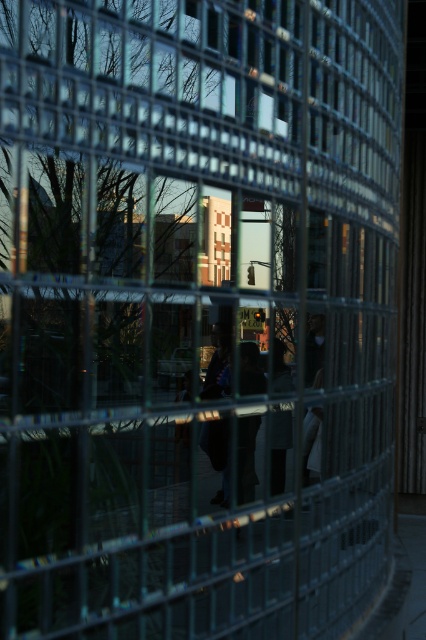
Question: Which point appears farthest from the camera in this image?

Choices:
 (A) (293, 387)
 (B) (241, 380)

Answer: (A)

Question: Which point is farther from the camera taking this photo?

Choices:
 (A) (287, 420)
 (B) (224, 384)

Answer: (A)

Question: Is dark fabric figure at center to the right of dark gray fabric at center from the viewer's perspective?

Choices:
 (A) no
 (B) yes

Answer: (A)

Question: Does dark fabric figure at center appear under dark gray fabric at center?

Choices:
 (A) no
 (B) yes

Answer: (A)

Question: Is dark fabric figure at center further to the viewer compared to dark gray fabric at center?

Choices:
 (A) yes
 (B) no

Answer: (B)